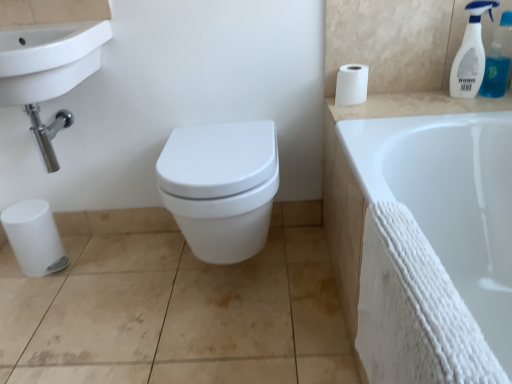
Where is `white ceramic counter top at upper right`? The image size is (512, 384). white ceramic counter top at upper right is located at coordinates (415, 105).

Describe the element at coordinates (351, 85) in the screenshot. I see `white matte toilet paper at upper right` at that location.

The width and height of the screenshot is (512, 384). Describe the element at coordinates (434, 247) in the screenshot. I see `white textured towel at lower right` at that location.

What is the approximate height of white textured towel at lower right?

white textured towel at lower right is 17.19 inches in height.

What do you see at coordinates (48, 71) in the screenshot?
I see `white ceramic sink at upper left` at bounding box center [48, 71].

Image resolution: width=512 pixels, height=384 pixels. Describe the element at coordinates (221, 187) in the screenshot. I see `white glossy bidet at center` at that location.

Measure the distance between point (227, 131) and camera.

Point (227, 131) and camera are 4.55 feet apart.

Identify the location of white plastic spray bottle at upper right, the first cleaning product from the left. (470, 53).

Would you say white ceramic sink at upper left is inside or outside white matte toilet paper at upper right?

white ceramic sink at upper left is spatially situated outside white matte toilet paper at upper right.

From the image's perspective, is white ceramic sink at upper left above or below white matte toilet paper at upper right?

From the image's perspective, white ceramic sink at upper left appears below white matte toilet paper at upper right.

From a real-world perspective, is white ceramic sink at upper left on top of white matte toilet paper at upper right?

Yes, from a real-world perspective, white ceramic sink at upper left is on top of white matte toilet paper at upper right.

Between point (28, 73) and point (362, 82), which one is positioned behind?

The point (362, 82) is farther from the camera.

Considering the relative sizes of clear plastic spray bottle at upper right, the second cleaning product in the left-to-right sequence, and white ceramic counter top at upper right in the image provided, is clear plastic spray bottle at upper right, the second cleaning product in the left-to-right sequence, thinner than white ceramic counter top at upper right?

Yes.

In terms of size, does clear plastic spray bottle at upper right, acting as the 1th cleaning product starting from the right, appear bigger or smaller than white ceramic counter top at upper right?

Clearly, clear plastic spray bottle at upper right, acting as the 1th cleaning product starting from the right, is larger in size than white ceramic counter top at upper right.

Considering the relative positions of clear plastic spray bottle at upper right, the second cleaning product in the left-to-right sequence, and white ceramic counter top at upper right in the image provided, is clear plastic spray bottle at upper right, the second cleaning product in the left-to-right sequence, to the left or to the right of white ceramic counter top at upper right?

Clearly, clear plastic spray bottle at upper right, the second cleaning product in the left-to-right sequence, is on the right of white ceramic counter top at upper right in the image.

Is clear plastic spray bottle at upper right, the second cleaning product in the left-to-right sequence, turned away from white ceramic counter top at upper right?

No, white ceramic counter top at upper right is not at the back of clear plastic spray bottle at upper right, the second cleaning product in the left-to-right sequence.

The height and width of the screenshot is (384, 512). Identify the location of toilet paper lying below the clear plastic spray bottle at upper right, acting as the 1th cleaning product starting from the right (from the image's perspective). (351, 85).

How far apart are white matte toilet paper at upper right and clear plastic spray bottle at upper right, acting as the 1th cleaning product starting from the right?

white matte toilet paper at upper right and clear plastic spray bottle at upper right, acting as the 1th cleaning product starting from the right, are 43.98 centimeters apart.

From the image's perspective, which one is positioned lower, white matte toilet paper at upper right or clear plastic spray bottle at upper right, acting as the 1th cleaning product starting from the right?

white matte toilet paper at upper right appears lower in the image.

Does white matte toilet paper at upper right lie behind clear plastic spray bottle at upper right, acting as the 1th cleaning product starting from the right?

Yes, white matte toilet paper at upper right is further from the camera.

From the image's perspective, which is above, white textured towel at lower right or white ceramic counter top at upper right?

From the image's view, white ceramic counter top at upper right is above.

Is white textured towel at lower right looking in the opposite direction of white ceramic counter top at upper right?

No, white ceramic counter top at upper right is not at the back of white textured towel at lower right.

How much distance is there between white textured towel at lower right and white ceramic counter top at upper right?

31.51 centimeters.

Is white textured towel at lower right wider than white ceramic counter top at upper right?

No.

Is white plastic spray bottle at upper right, which ranks as the second cleaning product in right-to-left order, aimed at clear plastic spray bottle at upper right, acting as the 1th cleaning product starting from the right?

No, white plastic spray bottle at upper right, which ranks as the second cleaning product in right-to-left order, is not turned towards clear plastic spray bottle at upper right, acting as the 1th cleaning product starting from the right.

Which of these two, white plastic spray bottle at upper right, which ranks as the second cleaning product in right-to-left order, or clear plastic spray bottle at upper right, the second cleaning product in the left-to-right sequence, is bigger?

With larger size is clear plastic spray bottle at upper right, the second cleaning product in the left-to-right sequence.

From the image's perspective, is white plastic spray bottle at upper right, which ranks as the second cleaning product in right-to-left order, on top of clear plastic spray bottle at upper right, acting as the 1th cleaning product starting from the right?

Actually, white plastic spray bottle at upper right, which ranks as the second cleaning product in right-to-left order, appears below clear plastic spray bottle at upper right, acting as the 1th cleaning product starting from the right, in the image.

How different are the orientations of white plastic spray bottle at upper right, the first cleaning product from the left, and clear plastic spray bottle at upper right, acting as the 1th cleaning product starting from the right, in degrees?

They differ by 0.00152 degrees in their facing directions.

From the image's perspective, which is above, white matte toilet paper at upper right or white plastic spray bottle at upper right, the first cleaning product from the left?

white plastic spray bottle at upper right, the first cleaning product from the left, is shown above in the image.

Which object is wider, white matte toilet paper at upper right or white plastic spray bottle at upper right, which ranks as the second cleaning product in right-to-left order?

With larger width is white matte toilet paper at upper right.

Are white matte toilet paper at upper right and white plastic spray bottle at upper right, the first cleaning product from the left, beside each other?

No, white matte toilet paper at upper right is not next to white plastic spray bottle at upper right, the first cleaning product from the left.

Relative to white ceramic sink at upper left, is white ceramic counter top at upper right in front or behind?

Visually, white ceramic counter top at upper right is located behind white ceramic sink at upper left.

Between point (368, 95) and point (7, 78), which one is positioned behind?

The point (368, 95) is farther from the camera.

Considering the sizes of objects white ceramic counter top at upper right and white ceramic sink at upper left in the image provided, who is bigger, white ceramic counter top at upper right or white ceramic sink at upper left?

With larger size is white ceramic sink at upper left.

Locate an element on the screen. sink that is above the white matte toilet paper at upper right (from a real-world perspective) is located at coordinates (48, 71).

At what (x,y) coordinates should I click in order to perform the action: click on counter top behind the clear plastic spray bottle at upper right, the second cleaning product in the left-to-right sequence. Please return your answer as a coordinate pair (x, y). Looking at the image, I should click on (415, 105).

Which object lies nearer to the anchor point white textured towel at lower right, white matte toilet paper at upper right or white ceramic sink at upper left?

white matte toilet paper at upper right.

Based on their spatial positions, is white matte toilet paper at upper right or white ceramic sink at upper left further from white ceramic counter top at upper right?

white ceramic sink at upper left lies further to white ceramic counter top at upper right than the other object.

Considering their positions, is white matte toilet paper at upper right positioned further to clear plastic spray bottle at upper right, acting as the 1th cleaning product starting from the right, than white glossy bidet at center?

white glossy bidet at center is positioned further to the anchor clear plastic spray bottle at upper right, acting as the 1th cleaning product starting from the right.

From the image, which object appears to be farther from white textured towel at lower right, white ceramic sink at upper left or white matte toilet paper at upper right?

Among the two, white ceramic sink at upper left is located further to white textured towel at lower right.

In the scene shown: Based on their spatial positions, is white textured towel at lower right or clear plastic spray bottle at upper right, the second cleaning product in the left-to-right sequence, further from white plastic spray bottle at upper right, which ranks as the second cleaning product in right-to-left order?

Based on the image, white textured towel at lower right appears to be further to white plastic spray bottle at upper right, which ranks as the second cleaning product in right-to-left order.

Based on their spatial positions, is white textured towel at lower right or white plastic spray bottle at upper right, the first cleaning product from the left, further from white glossy bidet at center?

Result: white plastic spray bottle at upper right, the first cleaning product from the left.

Based on their spatial positions, is white ceramic sink at upper left or white matte toilet paper at upper right closer to white glossy bidet at center?

white matte toilet paper at upper right is positioned closer to the anchor white glossy bidet at center.

Looking at the image, which one is located closer to white textured towel at lower right, white ceramic counter top at upper right or white plastic spray bottle at upper right, the first cleaning product from the left?

white ceramic counter top at upper right is positioned closer to the anchor white textured towel at lower right.

This screenshot has width=512, height=384. Find the location of `bidet between white ceramic sink at upper left and white matte toilet paper at upper right in the horizontal direction`. bidet between white ceramic sink at upper left and white matte toilet paper at upper right in the horizontal direction is located at coordinates (221, 187).

Where is `bidet between white ceramic sink at upper left and white textured towel at lower right`? This screenshot has height=384, width=512. bidet between white ceramic sink at upper left and white textured towel at lower right is located at coordinates (221, 187).

This screenshot has height=384, width=512. In order to click on bidet between white ceramic sink at upper left and white plastic spray bottle at upper right, which ranks as the second cleaning product in right-to-left order, from left to right in this screenshot , I will do `click(221, 187)`.

Identify the location of cleaning product between white ceramic sink at upper left and clear plastic spray bottle at upper right, acting as the 1th cleaning product starting from the right, in the horizontal direction. Image resolution: width=512 pixels, height=384 pixels. (470, 53).